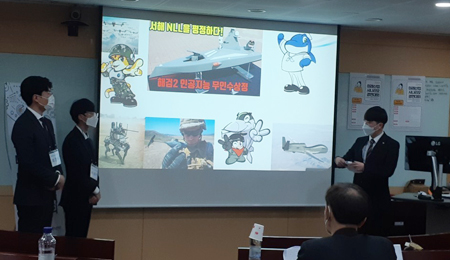
Identify the location of dry erase board. (347, 135), (66, 60).